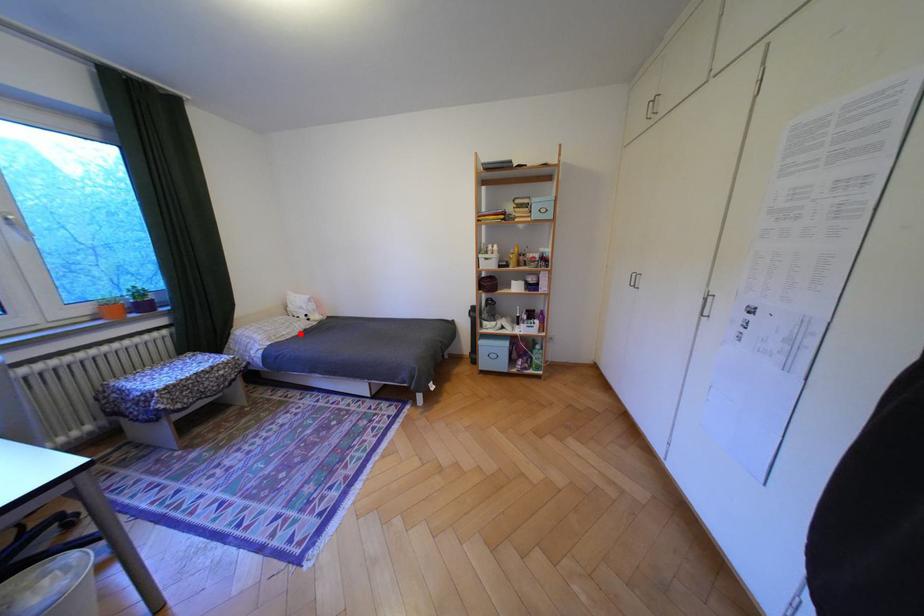
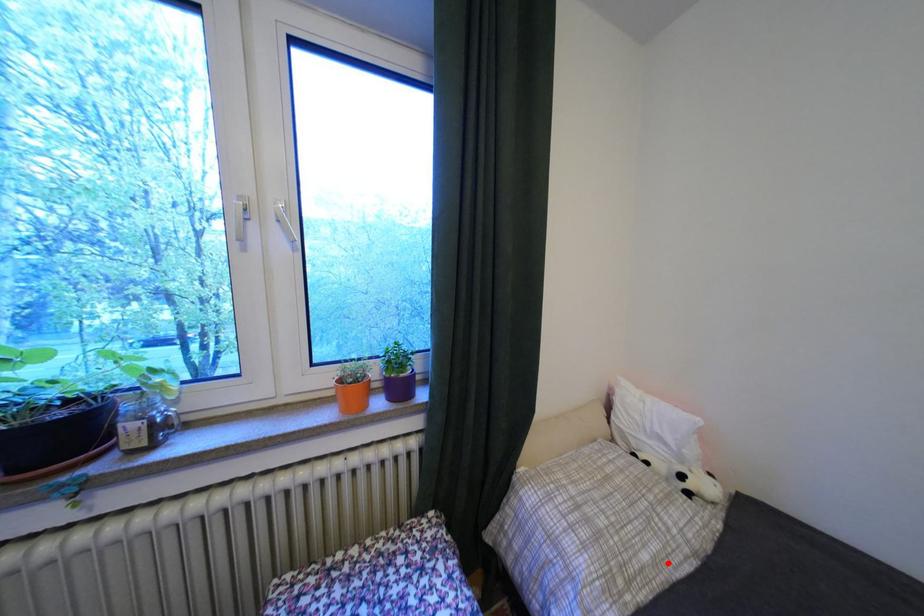
I am providing you with two images of the same scene from different viewpoints. A red point is marked on the first image and another point is marked on the second image. Do the highlighted points in image1 and image2 indicate the same real-world spot?

Yes